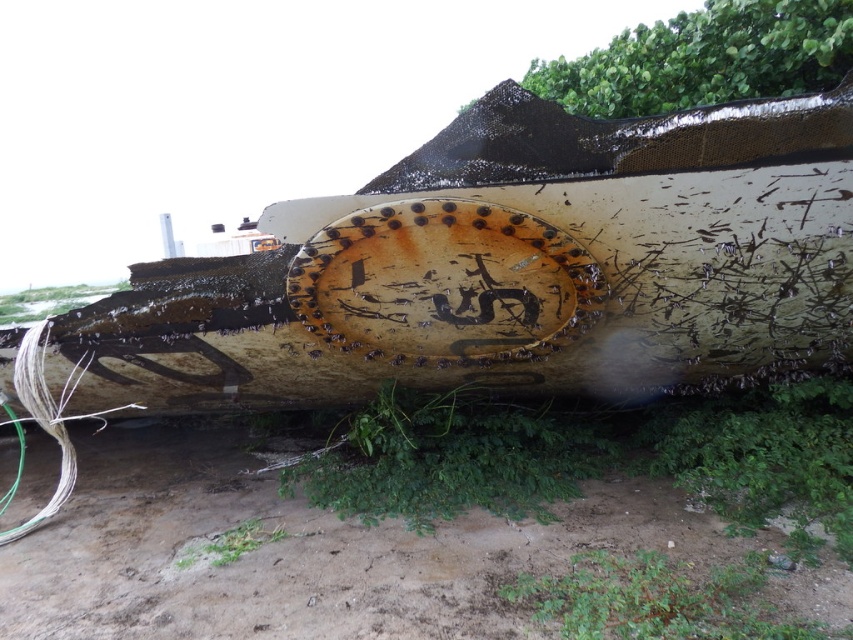
Which is behind, point (582, 243) or point (370, 632)?

Positioned behind is point (582, 243).

Which is more to the left, rusty metal boat at center or dull brown dirt track at lower center?

dull brown dirt track at lower center is more to the left.

Between point (397, 225) and point (569, 557), which one is positioned behind?

The point (397, 225) is behind.

Where is `rusty metal boat at center`? rusty metal boat at center is located at coordinates (509, 268).